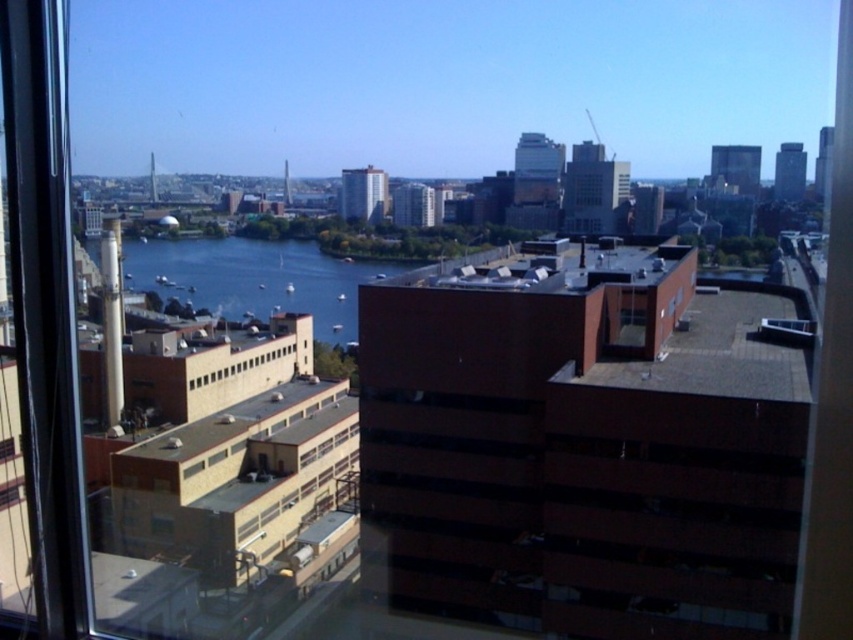
You are standing at the edge of the building rooftop with a reddish brown facade. You want to take a photo of the blue water at center. Which direction should you point your camera to capture it?

You should point your camera towards the center of the image to capture the blue water at center, as it is located at point coordinates of approximately 0.436 on the x axis and 0.299 on the y axis.

You are standing on the rooftop of the reddish brown building and want to take a photo of the yellow matte building at lower left and the blue water at center. Which object will appear larger in your photo?

The blue water at center will appear larger in your photo because it is taller than the yellow matte building at lower left.